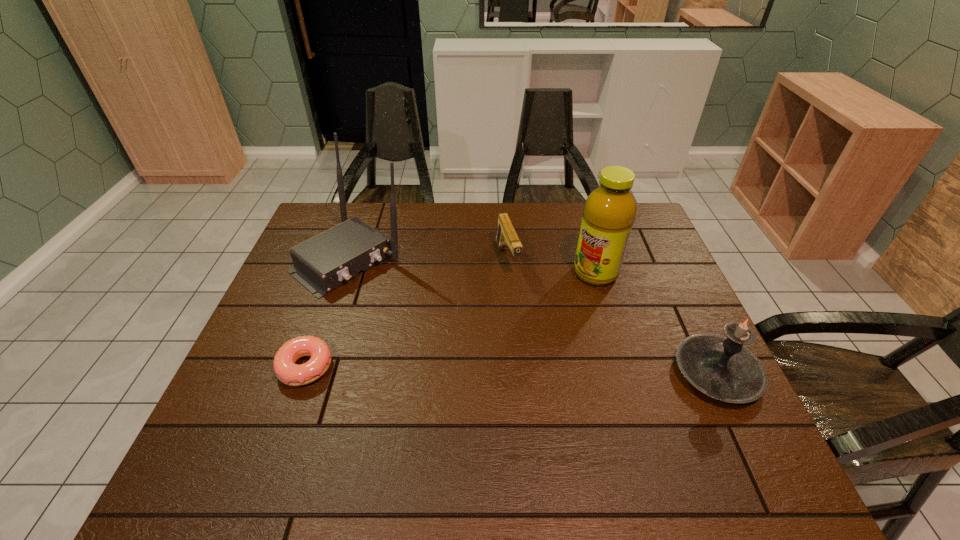
I want to click on vacant spot on the desktop that is between the shortest object and the third tallest object and is positioned at the barrel of the third object from left to right, so click(553, 371).

Identify the location of vacant space on the desktop that is between the doughnut and the candle and is positioned on the back of the router to connect cables. The height and width of the screenshot is (540, 960). (x=500, y=370).

This screenshot has width=960, height=540. I want to click on vacant space on the desktop that is between the doughnut and the candle and is positioned on the front label of the second object from right to left, so click(x=471, y=369).